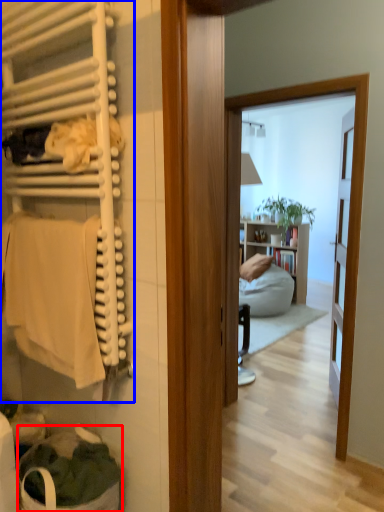
Question: Which point is further to the camera, laundry basket (highlighted by a red box) or closet (highlighted by a blue box)?

Choices:
 (A) laundry basket
 (B) closet

Answer: (A)